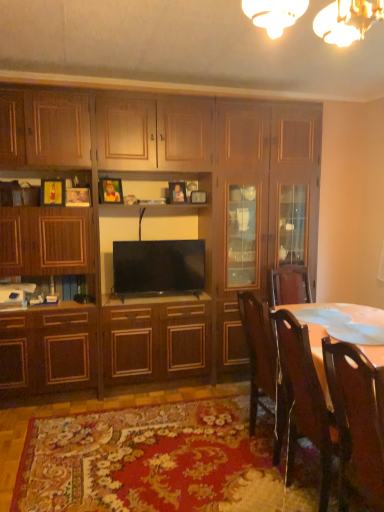
Question: Could you tell me if wooden cabinet at center is facing wooden chair at lower right, placed as the 1th chair when sorted from back to front?

Choices:
 (A) no
 (B) yes

Answer: (B)

Question: From the image's perspective, does wooden cabinet at center appear higher than wooden chair at lower right, the second chair when ordered from front to back?

Choices:
 (A) yes
 (B) no

Answer: (A)

Question: Considering the relative sizes of wooden cabinet at center and wooden chair at lower right, placed as the 1th chair when sorted from back to front, in the image provided, is wooden cabinet at center taller than wooden chair at lower right, placed as the 1th chair when sorted from back to front,?

Choices:
 (A) yes
 (B) no

Answer: (A)

Question: Can you confirm if wooden cabinet at center is shorter than wooden chair at lower right, placed as the 1th chair when sorted from back to front?

Choices:
 (A) yes
 (B) no

Answer: (B)

Question: Could wooden chair at lower right, the second chair when ordered from front to back, be considered to be inside wooden cabinet at center?

Choices:
 (A) no
 (B) yes

Answer: (A)

Question: Is the position of wooden cabinet at center more distant than that of wooden chair at lower right, placed as the 1th chair when sorted from back to front?

Choices:
 (A) no
 (B) yes

Answer: (B)

Question: Can you confirm if flat screen tv at center is bigger than wooden cabinet at center?

Choices:
 (A) no
 (B) yes

Answer: (A)

Question: Can we say flat screen tv at center lies outside wooden cabinet at center?

Choices:
 (A) yes
 (B) no

Answer: (B)

Question: From a real-world perspective, is flat screen tv at center physically above wooden cabinet at center?

Choices:
 (A) yes
 (B) no

Answer: (B)

Question: Is flat screen tv at center looking in the opposite direction of wooden cabinet at center?

Choices:
 (A) no
 (B) yes

Answer: (B)

Question: Is flat screen tv at center oriented towards wooden cabinet at center?

Choices:
 (A) yes
 (B) no

Answer: (A)

Question: Does flat screen tv at center appear on the right side of wooden cabinet at center?

Choices:
 (A) no
 (B) yes

Answer: (A)

Question: Could flat screen tv at center be considered to be inside wooden cabinet at center?

Choices:
 (A) no
 (B) yes

Answer: (B)